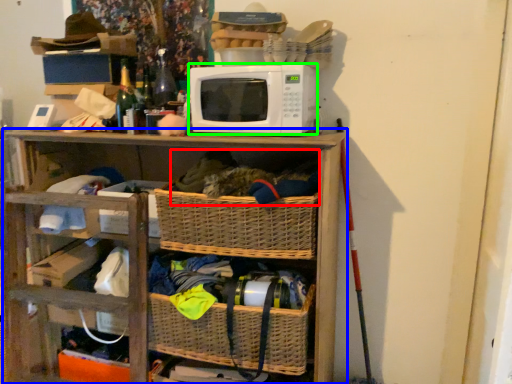
Question: Considering the real-world distances, which object is farthest from material (highlighted by a red box)? shelf (highlighted by a blue box) or microwave oven (highlighted by a green box)?

Choices:
 (A) shelf
 (B) microwave oven

Answer: (A)